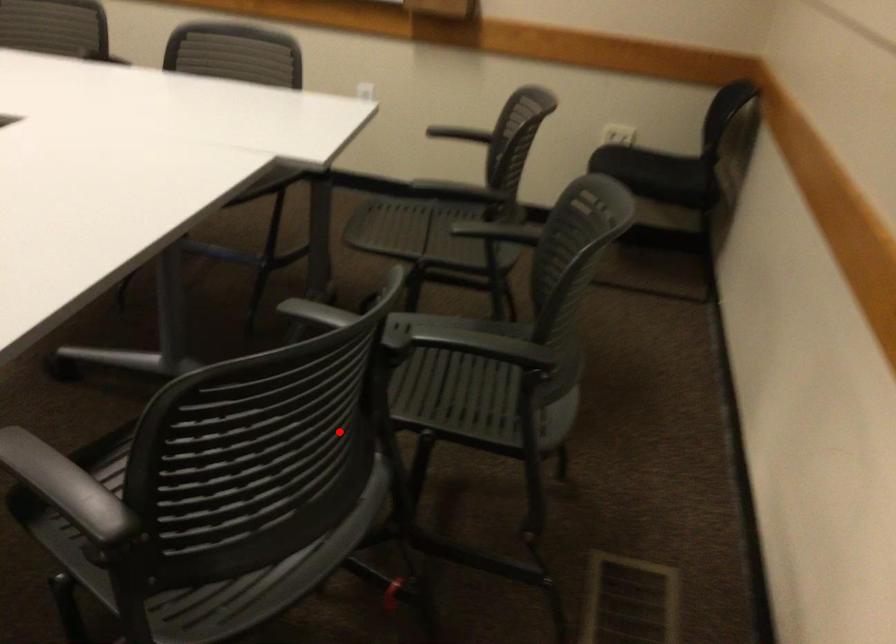
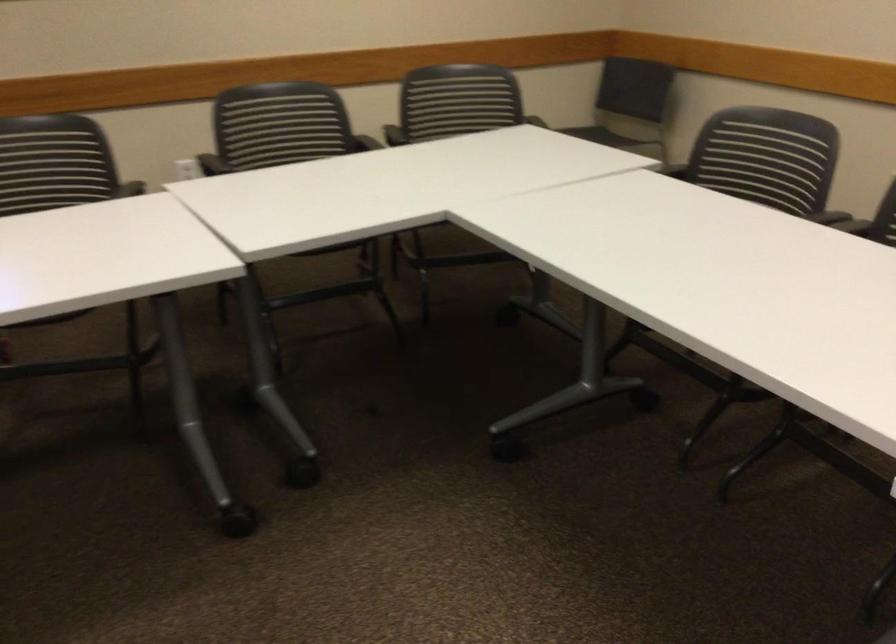
Locate, in the second image, the point that corresponds to the highlighted location in the first image.

(52, 163)